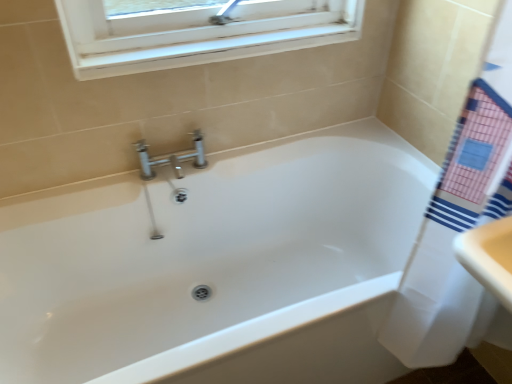
Question: Does point (91, 187) appear closer or farther from the camera than point (497, 168)?

Choices:
 (A) closer
 (B) farther

Answer: (B)

Question: Based on their sizes in the image, would you say white glossy bathtub at center is bigger or smaller than white fabric towel at right?

Choices:
 (A) big
 (B) small

Answer: (A)

Question: Is white glossy bathtub at center taller or shorter than white fabric towel at right?

Choices:
 (A) tall
 (B) short

Answer: (B)

Question: In the image, is white fabric towel at right positioned in front of or behind white glossy bathtub at center?

Choices:
 (A) front
 (B) behind

Answer: (A)

Question: Considering the relative positions of white fabric towel at right and white glossy bathtub at center in the image provided, is white fabric towel at right to the left or to the right of white glossy bathtub at center?

Choices:
 (A) right
 (B) left

Answer: (A)

Question: From their relative heights in the image, would you say white fabric towel at right is taller or shorter than white glossy bathtub at center?

Choices:
 (A) tall
 (B) short

Answer: (A)

Question: Looking at their shapes, would you say white fabric towel at right is wider or thinner than white glossy bathtub at center?

Choices:
 (A) wide
 (B) thin

Answer: (B)